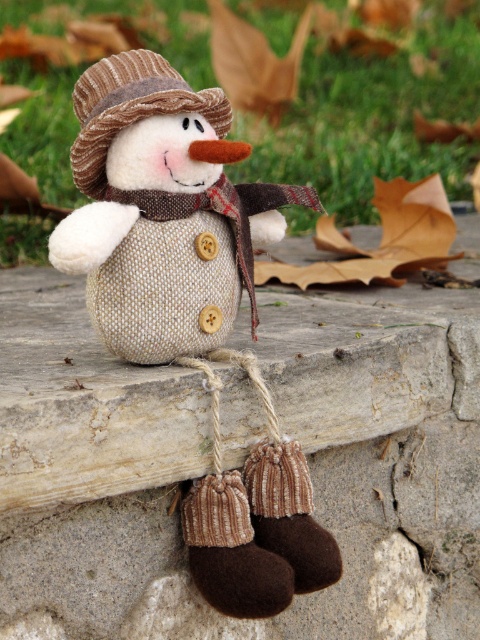
You are an observer standing in front of the snowman scene. You notice two burlap fabric snowman at center and burlap snowman at center. Which one is positioned to the right?

The burlap fabric snowman at center is positioned to the right of the burlap snowman at center.

You are an artist trying to sketch the scene. Where should you place the burlap snowman at center in your drawing if the canvas is divided into a grid with coordinates from 0 to 1 on both axes?

The burlap snowman at center should be placed at the coordinates point (191, 307) on the canvas grid.